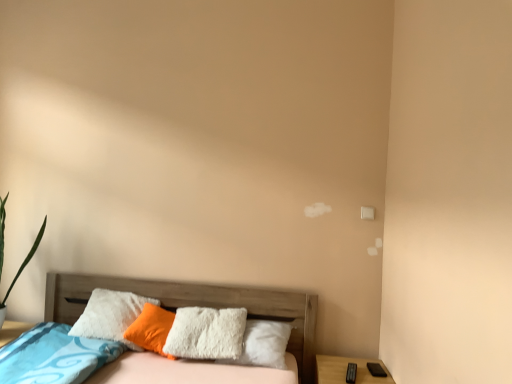
Measure the distance between point [359,379] and camera.

A distance of 7.86 feet exists between point [359,379] and camera.

The height and width of the screenshot is (384, 512). Identify the location of white fluffy pillow at center. (151, 329).

Who is more distant, wooden nightstand at lower right or wooden bed at lower left?

wooden nightstand at lower right is behind.

From a real-world perspective, which object stands above the other?

From a 3D spatial view, wooden bed at lower left is above.

At what (x,y) coordinates should I click in order to perform the action: click on bed on the left of wooden nightstand at lower right. Please return your answer as a coordinate pair (x, y). Looking at the image, I should click on (197, 305).

From a real-world perspective, is wooden bed at lower left above or below white fluffy pillow at center?

wooden bed at lower left is below white fluffy pillow at center.

Considering the positions of objects wooden bed at lower left and white fluffy pillow at center in the image provided, who is more to the left, wooden bed at lower left or white fluffy pillow at center?

white fluffy pillow at center.

Are wooden bed at lower left and white fluffy pillow at center far apart?

No.

Who is taller, wooden bed at lower left or white fluffy pillow at center?

wooden bed at lower left is taller.

From the image's perspective, which is below, white fluffy pillow at center or wooden nightstand at lower right?

wooden nightstand at lower right is shown below in the image.

The image size is (512, 384). I want to click on nightstand beneath the white fluffy pillow at center (from a real-world perspective), so click(346, 370).

From a real-world perspective, does white fluffy pillow at center stand above wooden nightstand at lower right?

Indeed, from a real-world perspective, white fluffy pillow at center stands above wooden nightstand at lower right.

From the picture: Would you consider white fluffy pillow at center to be distant from wooden nightstand at lower right?

white fluffy pillow at center is far away from wooden nightstand at lower right.

Where is `pillow on the left of wooden nightstand at lower right`? Image resolution: width=512 pixels, height=384 pixels. pillow on the left of wooden nightstand at lower right is located at coordinates (151, 329).

Is wooden nightstand at lower right outside of white fluffy pillow at center?

Yes, wooden nightstand at lower right is located beyond the bounds of white fluffy pillow at center.

Considering the relative sizes of wooden nightstand at lower right and white fluffy pillow at center in the image provided, is wooden nightstand at lower right thinner than white fluffy pillow at center?

In fact, wooden nightstand at lower right might be wider than white fluffy pillow at center.

Looking at this image, could you tell me if wooden nightstand at lower right is turned towards white fluffy pillow at center?

No, wooden nightstand at lower right is not turned towards white fluffy pillow at center.

From a real-world perspective, between wooden bed at lower left and wooden nightstand at lower right, who is vertically lower?

From a 3D spatial view, wooden nightstand at lower right is below.

Choose the correct answer: Is wooden bed at lower left inside wooden nightstand at lower right or outside it?

wooden bed at lower left is not enclosed by wooden nightstand at lower right.

Is wooden bed at lower left bigger than wooden nightstand at lower right?

Correct, wooden bed at lower left is larger in size than wooden nightstand at lower right.

From the image's perspective, would you say white fluffy pillow at center is shown under wooden bed at lower left?

No, from the image's perspective, white fluffy pillow at center is not beneath wooden bed at lower left.

Does white fluffy pillow at center have a greater height compared to wooden bed at lower left?

In fact, white fluffy pillow at center may be shorter than wooden bed at lower left.

Is point (156, 309) closer or farther from the camera than point (74, 286)?

Point (156, 309) appears to be closer to the viewer than point (74, 286).

Is white fluffy pillow at center inside or outside of wooden bed at lower left?

white fluffy pillow at center is enclosed within wooden bed at lower left.

In order to click on bed that is above the wooden nightstand at lower right (from a real-world perspective) in this screenshot , I will do `click(197, 305)`.

The width and height of the screenshot is (512, 384). In order to click on bed below the white fluffy pillow at center (from the image's perspective) in this screenshot , I will do `click(197, 305)`.

Looking at the image, which one is located further to wooden nightstand at lower right, wooden bed at lower left or white fluffy pillow at center?

Among the two, white fluffy pillow at center is located further to wooden nightstand at lower right.

Based on their spatial positions, is white fluffy pillow at center or wooden nightstand at lower right closer to wooden bed at lower left?

white fluffy pillow at center is closer to wooden bed at lower left.

Considering their positions, is white fluffy pillow at center positioned closer to wooden nightstand at lower right than wooden bed at lower left?

The object closer to wooden nightstand at lower right is wooden bed at lower left.

Which object lies nearer to the anchor point white fluffy pillow at center, wooden nightstand at lower right or wooden bed at lower left?

Based on the image, wooden bed at lower left appears to be nearer to white fluffy pillow at center.

From the picture: Based on their spatial positions, is wooden nightstand at lower right or white fluffy pillow at center further from wooden bed at lower left?

Based on the image, wooden nightstand at lower right appears to be further to wooden bed at lower left.

Looking at the image, which one is located further to white fluffy pillow at center, wooden bed at lower left or wooden nightstand at lower right?

Based on the image, wooden nightstand at lower right appears to be further to white fluffy pillow at center.

The image size is (512, 384). I want to click on bed between white fluffy pillow at center and wooden nightstand at lower right in the horizontal direction, so click(197, 305).